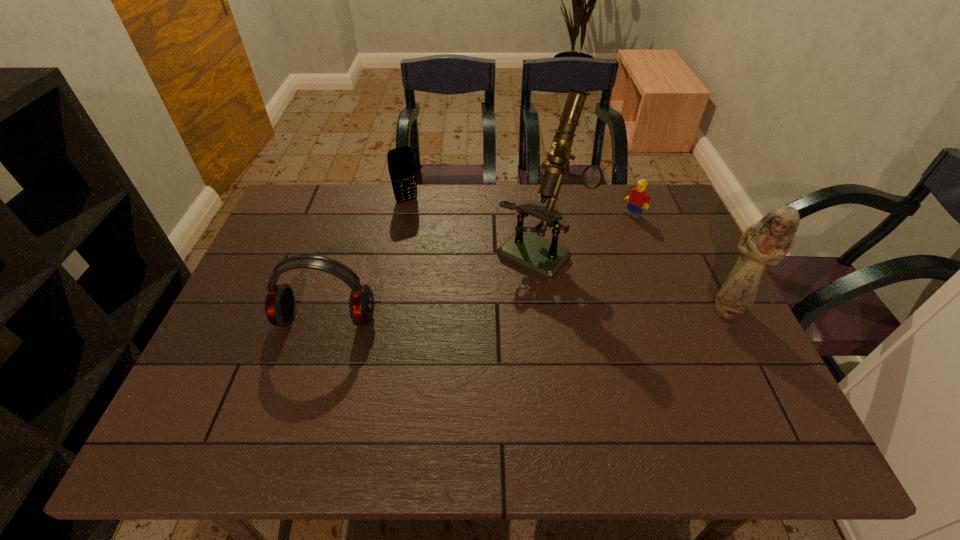
Where is `free area in between the farthest object and the microscope`? The height and width of the screenshot is (540, 960). free area in between the farthest object and the microscope is located at coordinates (472, 226).

Identify the location of free space between the earphone and the microscope. (432, 286).

This screenshot has width=960, height=540. I want to click on empty space that is in between the tallest object and the Lego, so click(586, 233).

Where is `unoccupied area between the figurine and the third object from left to right`? This screenshot has height=540, width=960. unoccupied area between the figurine and the third object from left to right is located at coordinates (632, 281).

Where is `vacant space that's between the earphone and the tallest object`? This screenshot has width=960, height=540. vacant space that's between the earphone and the tallest object is located at coordinates (432, 286).

Locate an element on the screen. The height and width of the screenshot is (540, 960). vacant point located between the cellular telephone and the earphone is located at coordinates (367, 260).

Choose which object is the second nearest neighbor to the figurine. Please provide its 2D coordinates. Your answer should be formatted as a tuple, i.e. [(x, y)], where the tuple contains the x and y coordinates of a point satisfying the conditions above.

[(638, 198)]

I want to click on the second closest object to the microscope, so click(401, 163).